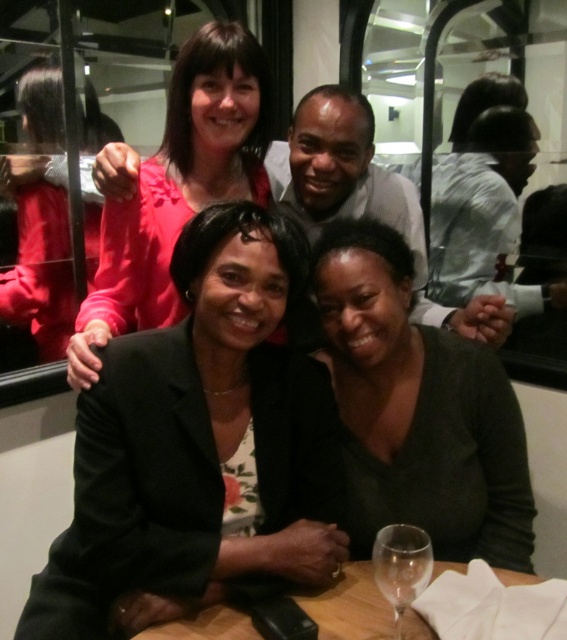
Question: Among these points, which one is farthest from the camera?

Choices:
 (A) (456, 426)
 (B) (509, 573)

Answer: (A)

Question: Which point is closer to the camera?

Choices:
 (A) matte pink blouse at upper center
 (B) dark green sweater at center
 (C) black matte blazer at center
 (D) wooden table at lower center

Answer: (D)

Question: Is white shirt at upper center closer to camera compared to matte pink sweater at upper left?

Choices:
 (A) no
 (B) yes

Answer: (B)

Question: Which object is farther from the camera taking this photo?

Choices:
 (A) dark green sweater at center
 (B) matte pink blouse at upper center

Answer: (A)

Question: Does black matte blazer at center appear under dark green sweater at center?

Choices:
 (A) no
 (B) yes

Answer: (B)

Question: Observing the image, what is the correct spatial positioning of matte pink sweater at upper left in reference to transparent glass at lower center?

Choices:
 (A) left
 (B) right

Answer: (A)